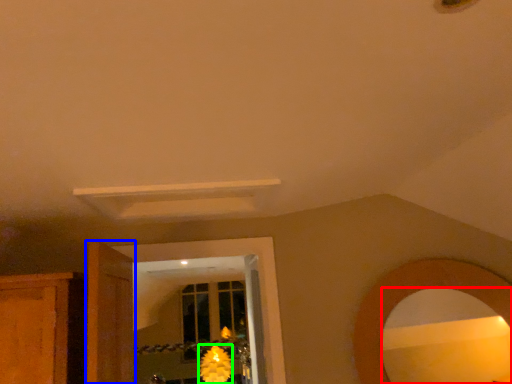
Question: Which object is positioned farthest from mirror (highlighted by a red box)? Select from door (highlighted by a blue box) and flower (highlighted by a green box).

Choices:
 (A) door
 (B) flower

Answer: (B)